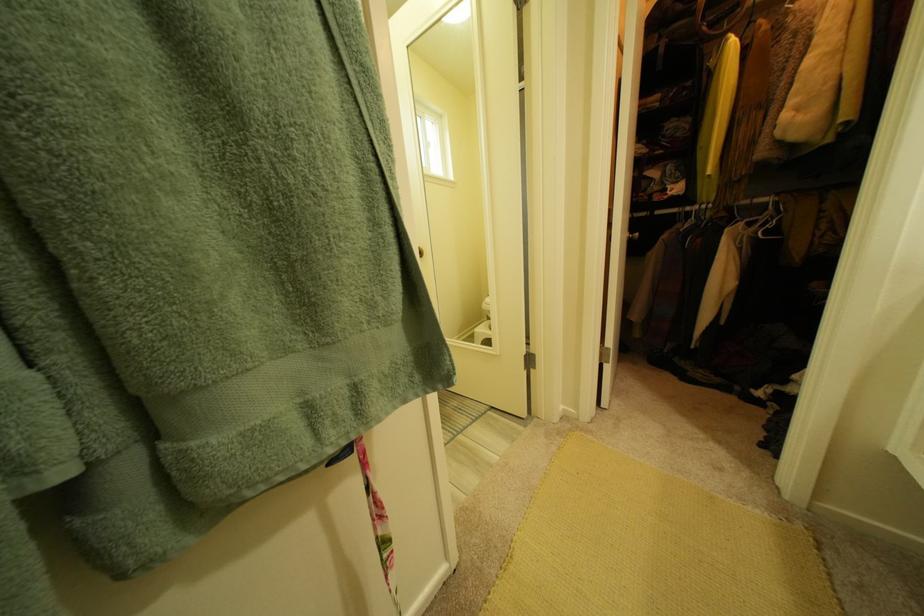
Which object does [771,205] point to?

It corresponds to the white clothes hanger in the image.